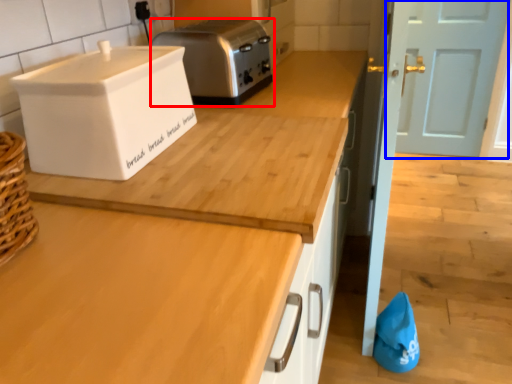
Question: Which object appears farthest to the camera in this image, toaster (highlighted by a red box) or door (highlighted by a blue box)?

Choices:
 (A) toaster
 (B) door

Answer: (B)